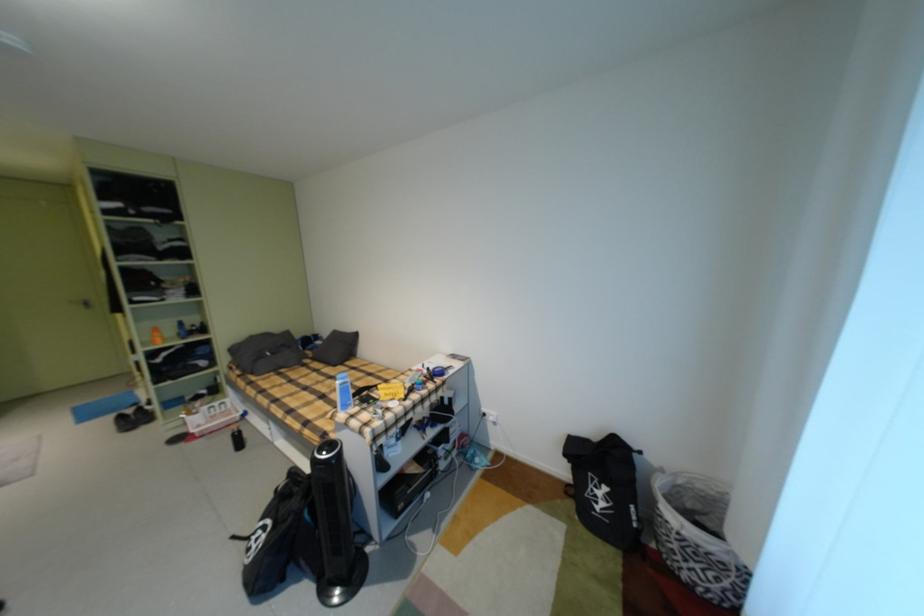
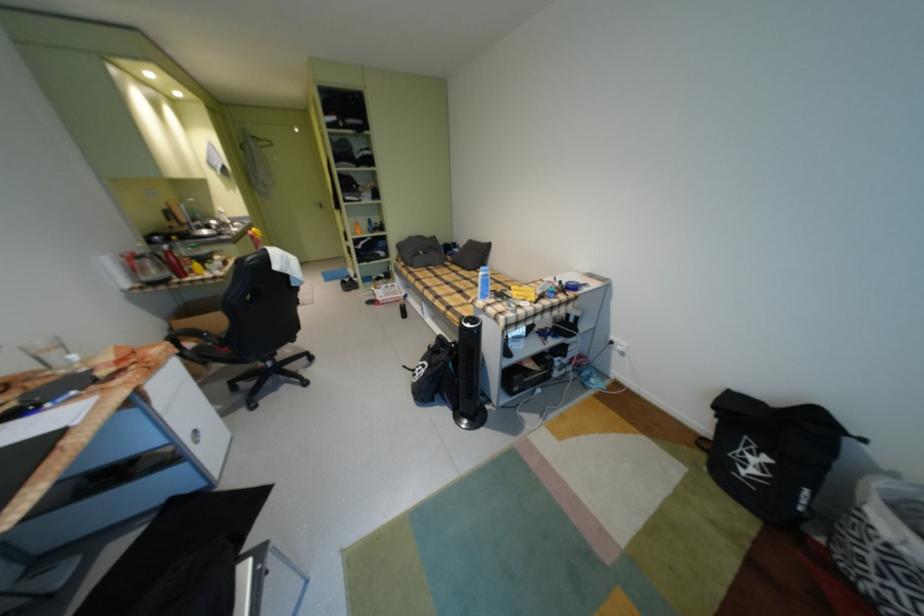
Find the pixel in the second image that matches (x=677, y=523) in the first image.

(882, 529)